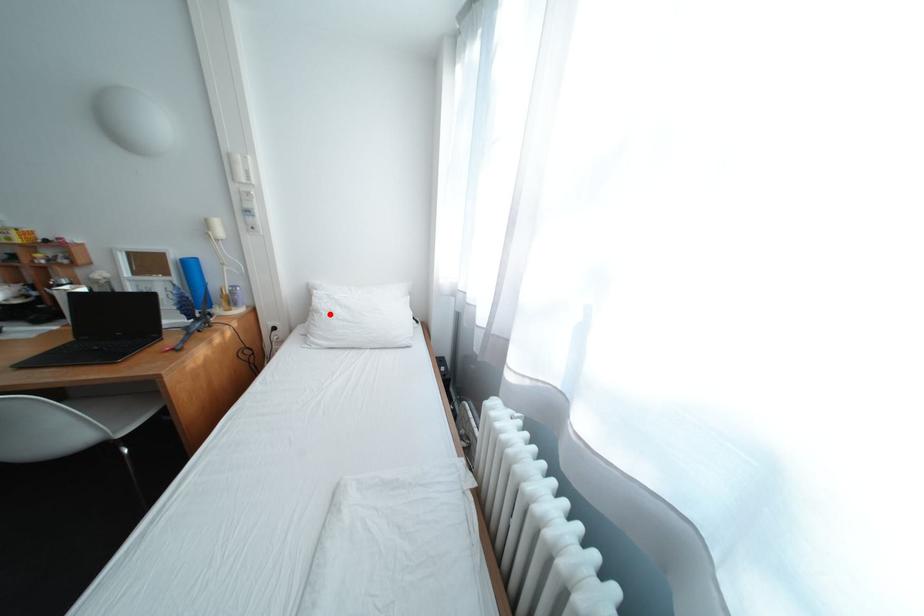
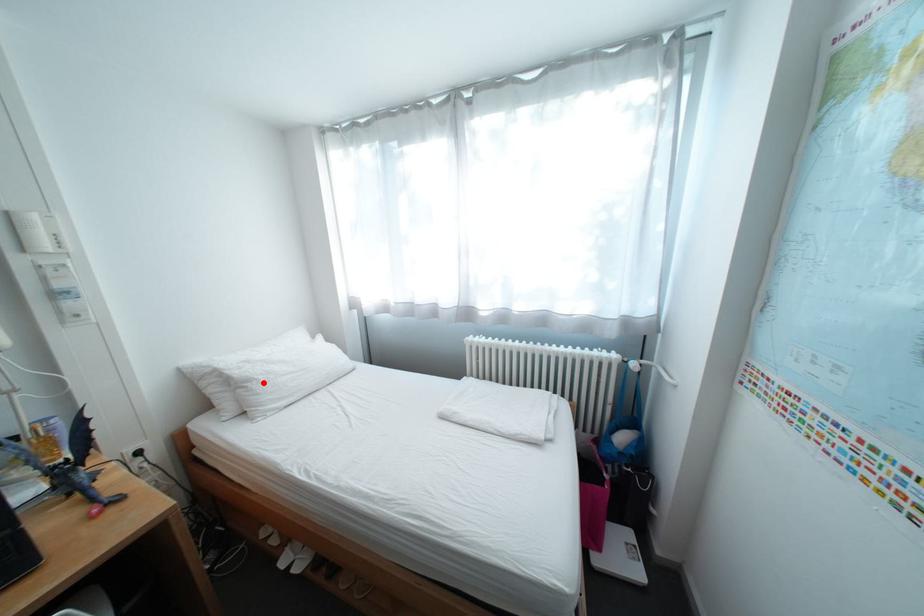
I am providing you with two images of the same scene from different viewpoints. A red point is marked on the first image and another point is marked on the second image. Do the highlighted points in image1 and image2 indicate the same real-world spot?

Yes